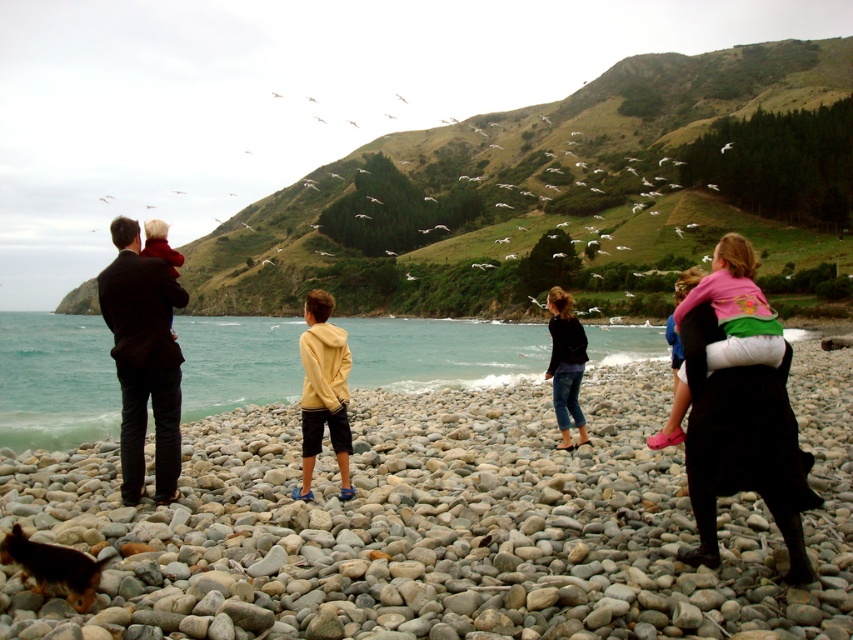
Question: Does teal water at center have a greater width compared to dark suit at left?

Choices:
 (A) yes
 (B) no

Answer: (A)

Question: From the image, what is the correct spatial relationship of brown fur dog at lower left in relation to denim pants at center?

Choices:
 (A) right
 (B) left

Answer: (B)

Question: Which point appears closest to the camera in this image?

Choices:
 (A) (126, 374)
 (B) (712, 582)
 (C) (308, 358)

Answer: (B)

Question: Which of the following is the closest to the observer?

Choices:
 (A) teal water at center
 (B) smooth pebbles at center
 (C) denim pants at center

Answer: (B)

Question: Does smooth pebbles at center appear on the right side of dark suit at left?

Choices:
 (A) no
 (B) yes

Answer: (B)

Question: Which point appears farthest from the camera in this image?

Choices:
 (A) (20, 515)
 (B) (573, 332)
 (C) (339, 353)
 (D) (1, 381)

Answer: (D)